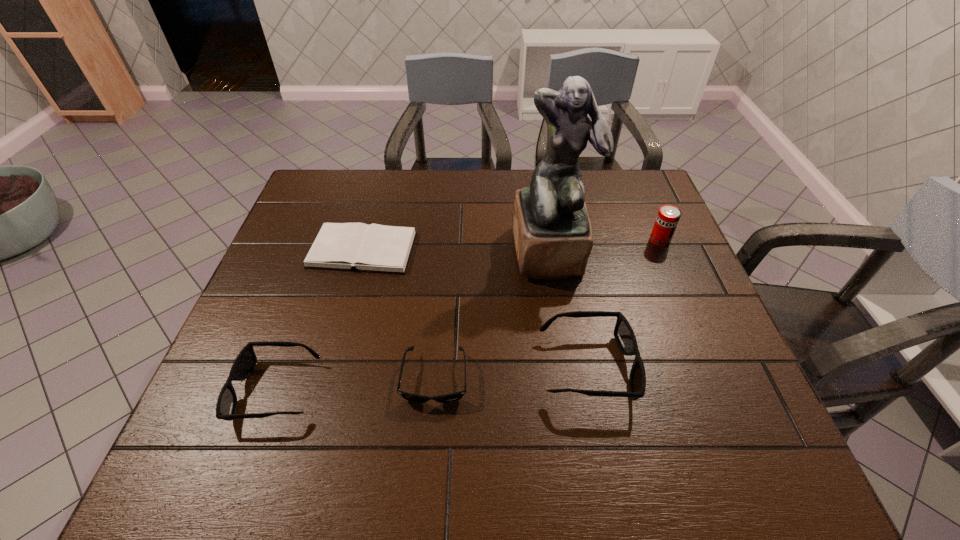
The width and height of the screenshot is (960, 540). I want to click on the leftmost sunglasses, so click(x=245, y=362).

In order to click on the second tallest sunglasses in this screenshot , I will do `click(245, 362)`.

I want to click on the shortest sunglasses, so click(x=451, y=397).

The width and height of the screenshot is (960, 540). I want to click on the third object from left to right, so click(451, 397).

Locate an element on the screen. the tallest sunglasses is located at coordinates 624,335.

Find the location of a particular element. the fourth shortest object is located at coordinates (624, 335).

Locate an element on the screen. This screenshot has height=540, width=960. the tallest object is located at coordinates (553, 239).

In order to click on the shortest object in this screenshot , I will do `click(376, 248)`.

Locate an element on the screen. This screenshot has height=540, width=960. the rightmost object is located at coordinates (668, 216).

Where is `can`? This screenshot has width=960, height=540. can is located at coordinates (668, 216).